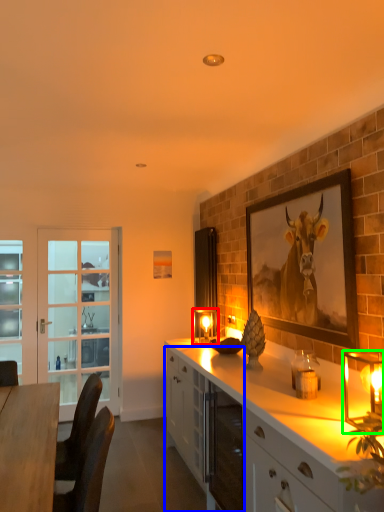
Question: Estimate the real-world distances between objects in this image. Which object is farther from candle holder (highlighted by a red box), cabinetry (highlighted by a blue box) or candle holder (highlighted by a green box)?

Choices:
 (A) cabinetry
 (B) candle holder

Answer: (B)